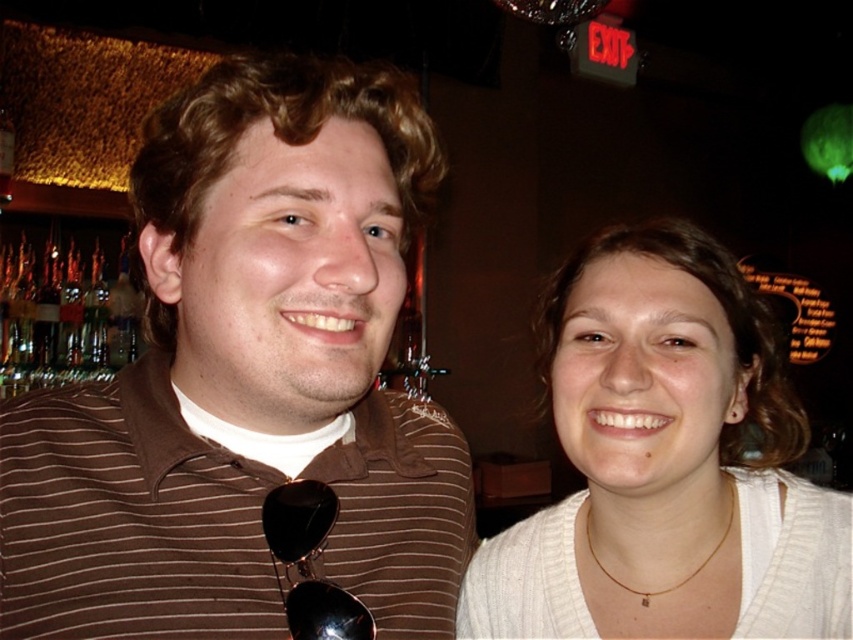
Question: Among these points, which one is farthest from the camera?

Choices:
 (A) (751, 340)
 (B) (229, 259)

Answer: (A)

Question: Can you confirm if brown striped shirt at left is positioned to the left of white knitwear at right?

Choices:
 (A) yes
 (B) no

Answer: (A)

Question: Can you confirm if brown striped shirt at left is wider than white knitwear at right?

Choices:
 (A) no
 (B) yes

Answer: (A)

Question: Does brown striped shirt at left appear over white knitwear at right?

Choices:
 (A) no
 (B) yes

Answer: (B)